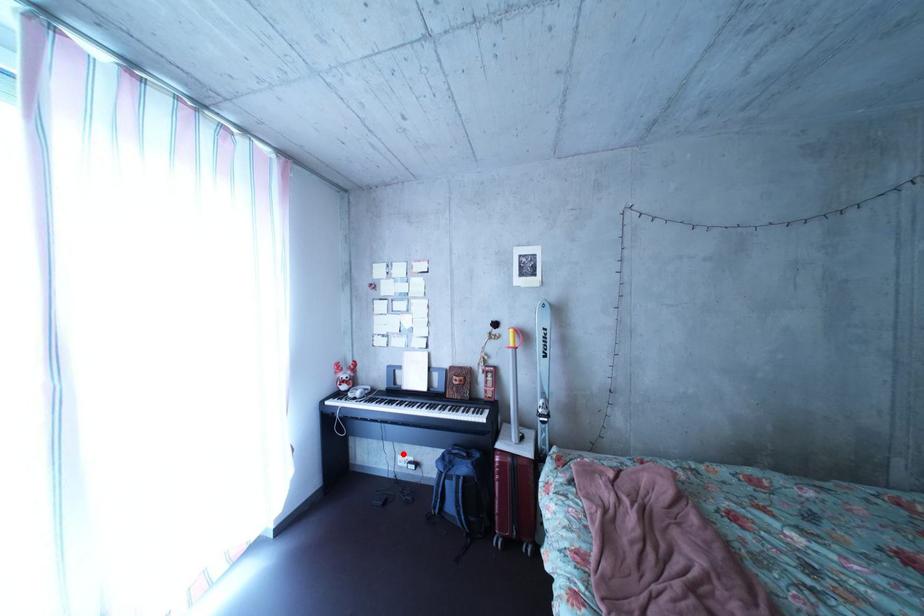
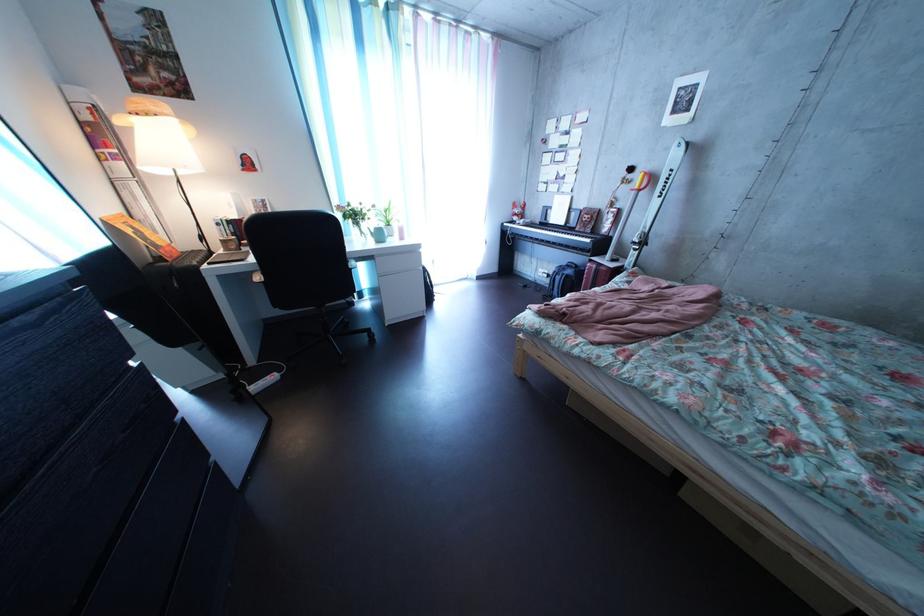
Question: I am providing you with two images of the same scene from different viewpoints. Image1 has a red point marked. In image2, the corresponding 3D location appears at what relative position? Reply with the corresponding letter.

Choices:
 (A) Closer
 (B) Farther

Answer: (A)